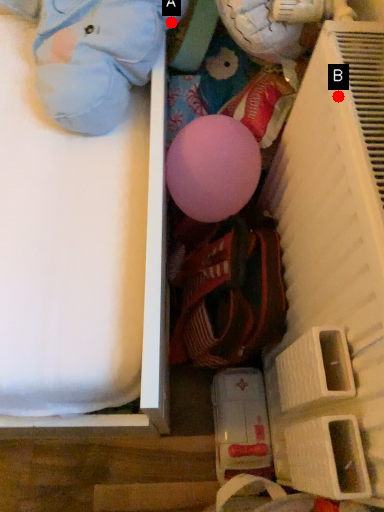
Question: Two points are circled on the image, labeled by A and B beside each circle. Which point appears closest to the camera in this image?

Choices:
 (A) A is closer
 (B) B is closer

Answer: (B)